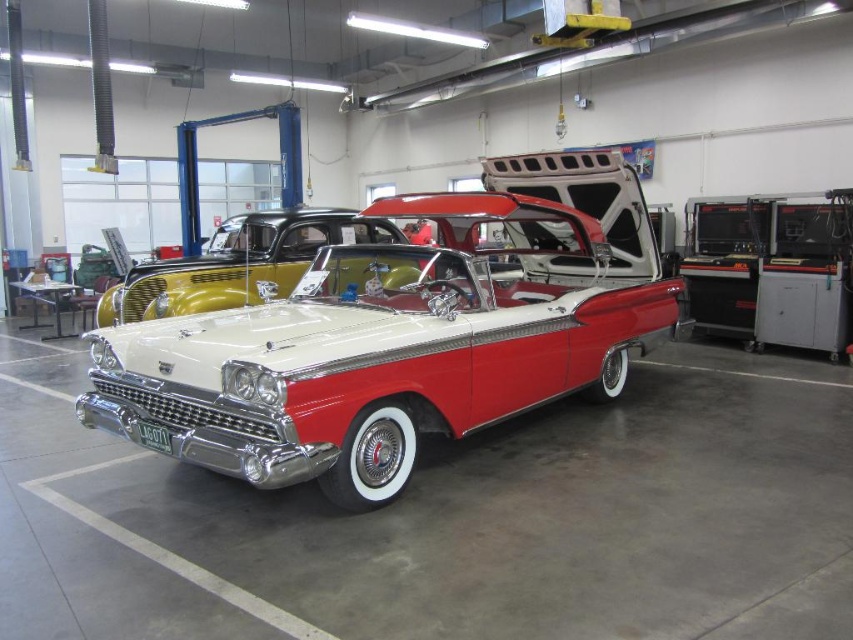
You are a visitor in the garage and want to take a photo of the shiny chrome car at center. Where should you position yourself to ensure the car is in the frame?

The shiny chrome car at center is located at point coordinates (402,337), so positioning yourself directly in front of it at that central point would ensure it is centered in your photo frame.

You are an appraiser evaluating the condition of the shiny chrome car at center and the shiny chrome grill at center in the garage. Which object would you need to examine more carefully for potential damage due to its size?

The shiny chrome car at center is larger in size than the shiny chrome grill at center, so you should examine the shiny chrome car at center more carefully for potential damage due to its size.

You are a mechanic working in the garage and need to clean the shiny chrome car at center and the shiny chrome grill at center. If your cleaning spray can only reach up to 3 meters, can you clean both objects without moving the spray bottle?

The shiny chrome car at center and shiny chrome grill at center are 3.06 meters apart from each other. Since the spray can only reach up to 3 meters, the distance between them is slightly beyond the spray bottle range. Therefore, you cannot clean both objects without moving the spray bottle.